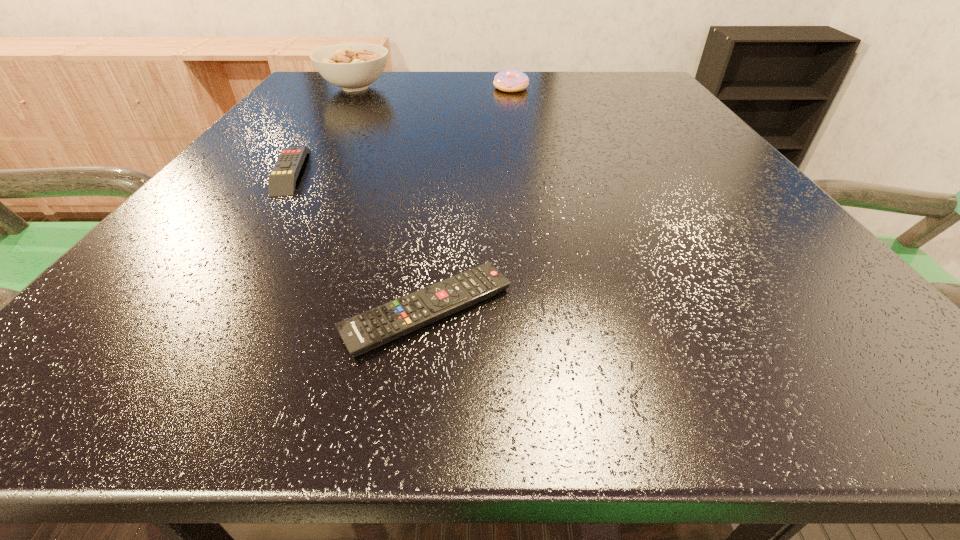
Find the location of a particular element. The height and width of the screenshot is (540, 960). free location at the far left corner of the desktop is located at coordinates (313, 93).

The image size is (960, 540). In order to click on blank space at the far right corner of the desktop in this screenshot , I will do `click(628, 93)`.

The image size is (960, 540). Find the location of `vacant space in between the farther remote control and the third shortest object`. vacant space in between the farther remote control and the third shortest object is located at coordinates (401, 130).

I want to click on vacant space that is in between the second shortest object and the doughnut, so click(401, 130).

The image size is (960, 540). In order to click on free space that is in between the stew and the right remote control in this screenshot , I will do `click(392, 199)`.

Find the location of a particular element. This screenshot has height=540, width=960. free space that is in between the farther remote control and the stew is located at coordinates (324, 129).

Where is `unoccupied area between the shortest object and the doughnut`? This screenshot has height=540, width=960. unoccupied area between the shortest object and the doughnut is located at coordinates (469, 199).

I want to click on vacant area that lies between the taller remote control and the third shortest object, so click(401, 130).

At what (x,y) coordinates should I click in order to perform the action: click on free area in between the tallest object and the nearest object. Please return your answer as a coordinate pair (x, y). The height and width of the screenshot is (540, 960). Looking at the image, I should click on (392, 199).

Where is `empty space that is in between the shortest object and the doughnut`? empty space that is in between the shortest object and the doughnut is located at coordinates (469, 199).